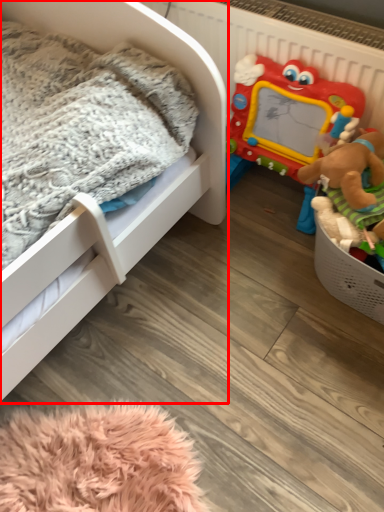
Question: In this image, where is infant bed (annotated by the red box) located relative to toy?

Choices:
 (A) right
 (B) left

Answer: (B)